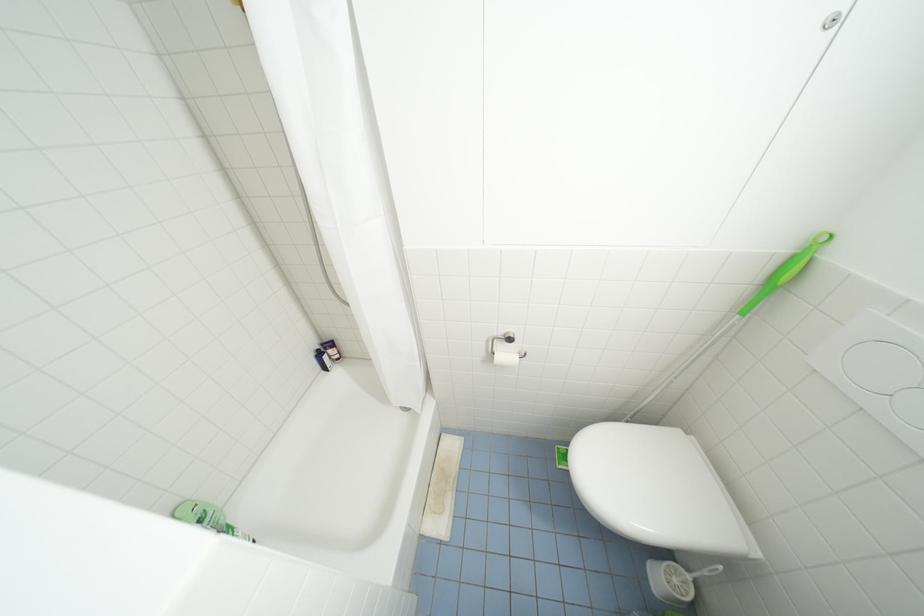
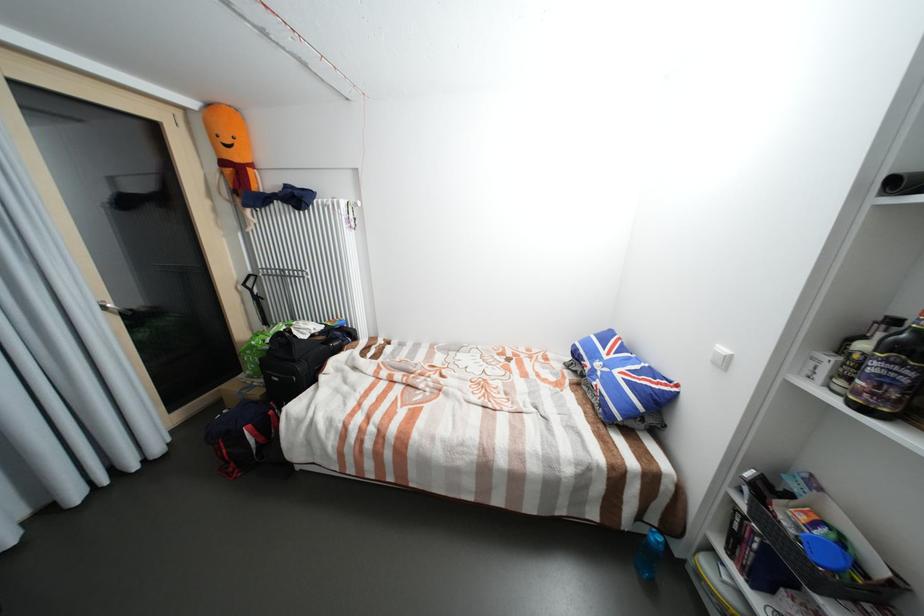
Question: What movement of the cameraman would produce the second image?

Choices:
 (A) Left
 (B) Right
 (C) Forward
 (D) Backward

Answer: (A)